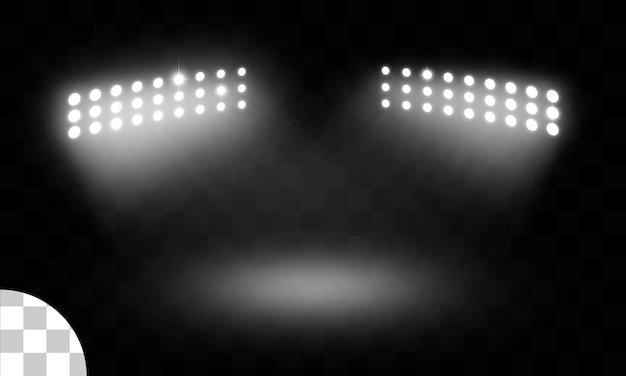
Where is `digitally rendered bulbs that have light beams`? This screenshot has width=626, height=376. digitally rendered bulbs that have light beams is located at coordinates (177, 78), (218, 92), (429, 75), (550, 112).